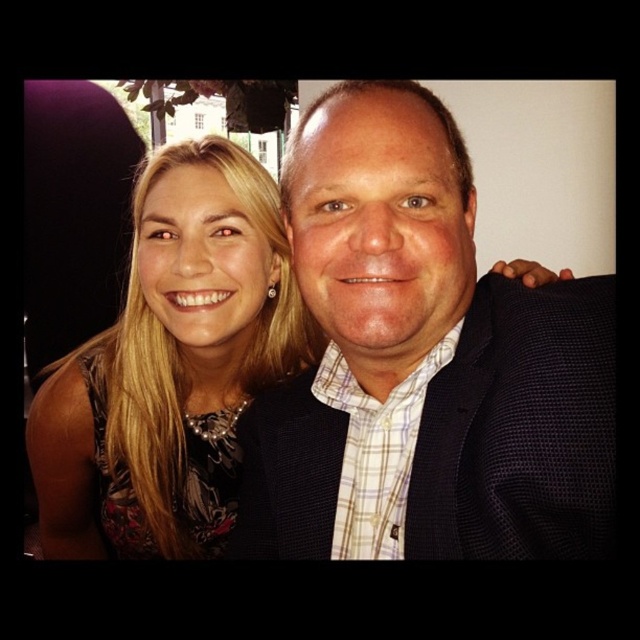
Identify the location of matte black suit at center. The image size is (640, 640). (424, 364).

Looking at this image, between matte black suit at center and matte black dress at left, which one is positioned higher?

matte black suit at center is higher up.

Is point (440, 141) farther from viewer compared to point (186, 524)?

No, (440, 141) is in front of (186, 524).

This screenshot has height=640, width=640. In order to click on matte black suit at center in this screenshot , I will do `click(424, 364)`.